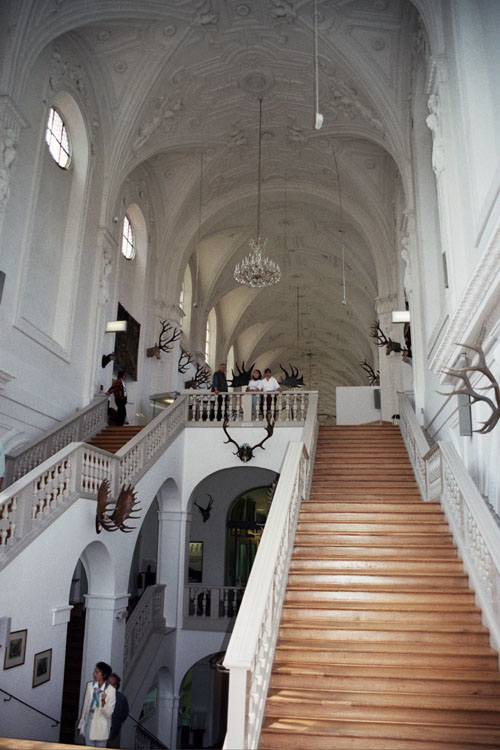
Locate an element on the screen. This screenshot has width=500, height=750. gray antlers on wall is located at coordinates (475, 397), (489, 373).